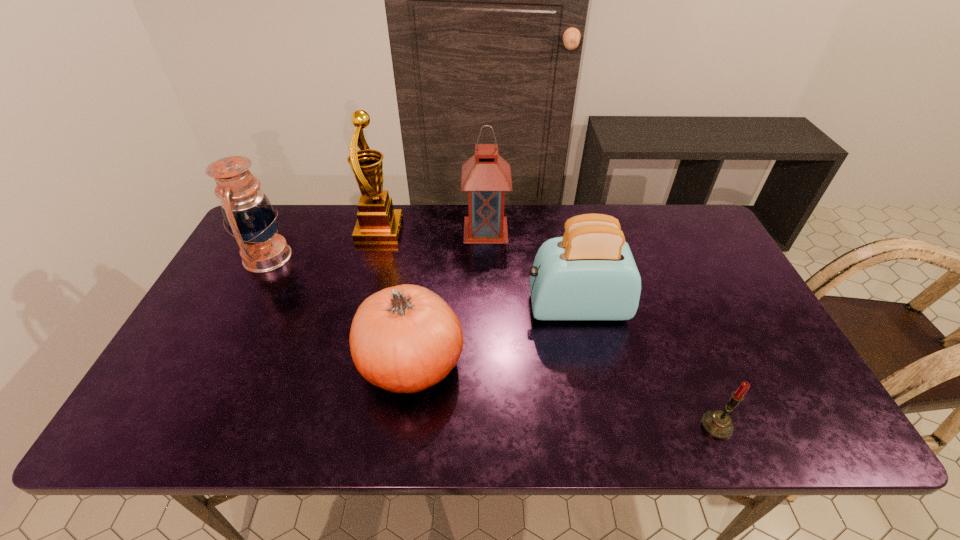
Locate an element on the screen. Image resolution: width=960 pixels, height=540 pixels. empty location between the toaster and the rightmost object is located at coordinates (646, 366).

Where is `free space between the pumpkin and the candle`? The width and height of the screenshot is (960, 540). free space between the pumpkin and the candle is located at coordinates (564, 394).

Where is `free space that is in between the pumpkin and the leftmost object`? free space that is in between the pumpkin and the leftmost object is located at coordinates (340, 309).

This screenshot has height=540, width=960. I want to click on vacant space that is in between the fifth tallest object and the oil lamp, so click(340, 309).

Image resolution: width=960 pixels, height=540 pixels. Identify the location of free space between the pumpkin and the oil lamp. (340, 309).

Select which object is the third closest to the toaster. Please provide its 2D coordinates. Your answer should be formatted as a tuple, i.e. [(x, y)], where the tuple contains the x and y coordinates of a point satisfying the conditions above.

[(718, 424)]

Where is `object identified as the closest to the lantern`? The width and height of the screenshot is (960, 540). object identified as the closest to the lantern is located at coordinates (588, 274).

What are the coordinates of `vacant region that satisfies the following two spatial constraints: 1. on the front side of the lantern; 2. on the left side of the candle` in the screenshot? It's located at (489, 426).

Where is `vacant point that satisfies the following two spatial constraints: 1. on the front-facing side of the award; 2. on the left side of the lantern`? The image size is (960, 540). vacant point that satisfies the following two spatial constraints: 1. on the front-facing side of the award; 2. on the left side of the lantern is located at coordinates (379, 230).

This screenshot has height=540, width=960. In order to click on vacant space that satisfies the following two spatial constraints: 1. on the back side of the leftmost object; 2. on the left side of the lantern in this screenshot , I will do `click(281, 230)`.